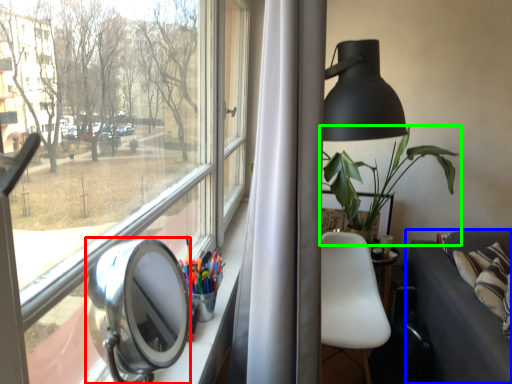
Question: Which is nearer to the view mirror (highlighted by a red box)? studio couch (highlighted by a blue box) or houseplant (highlighted by a green box).

Choices:
 (A) studio couch
 (B) houseplant

Answer: (A)